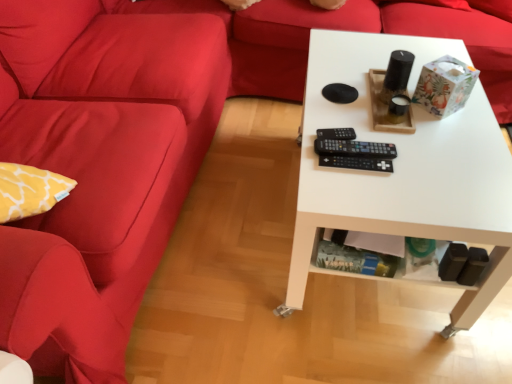
Identify the location of vacant space behind black plastic remote at center, the 1th control when ordered from bottom to top. This screenshot has height=384, width=512. (349, 122).